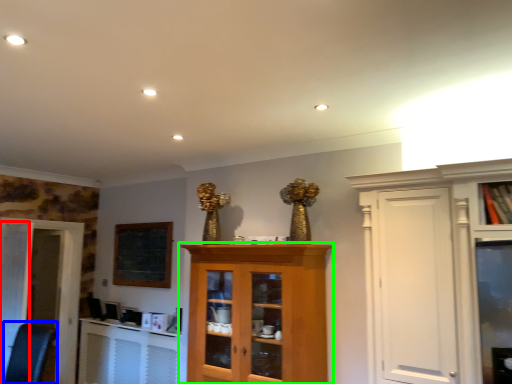
Question: Estimate the real-world distances between objects in this image. Which object is farther from door (highlighted by a red box), swivel chair (highlighted by a blue box) or cupboard (highlighted by a green box)?

Choices:
 (A) swivel chair
 (B) cupboard

Answer: (B)